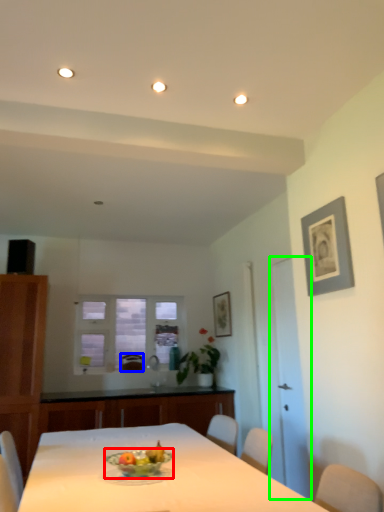
Question: Which is farther away from glass bowl (highlighted by a red box)? armchair (highlighted by a blue box) or glass door (highlighted by a green box)?

Choices:
 (A) armchair
 (B) glass door

Answer: (A)